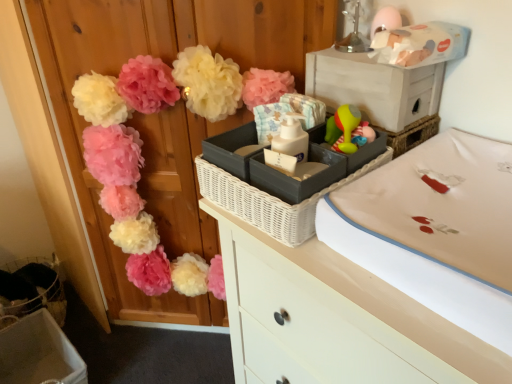
The width and height of the screenshot is (512, 384). What do you see at coordinates (442, 205) in the screenshot?
I see `beige fabric changing pad at center-right` at bounding box center [442, 205].

What do you see at coordinates (270, 201) in the screenshot? I see `black wicker basket at center` at bounding box center [270, 201].

The width and height of the screenshot is (512, 384). I want to click on matte plastic storage box at lower left, the 2th storage box from the front, so click(39, 352).

What is the approximate height of matte plastic storage box at lower left, arranged as the 1th storage box when viewed from the left?

10.54 inches.

Locate an element on the screen. This screenshot has height=384, width=512. matte gray storage box at upper right, acting as the 2th storage box starting from the back is located at coordinates (374, 87).

Considering their positions, is white glossy chest of drawers at upper center located in front of or behind matte gray storage box at upper right, the first storage box in the top-to-bottom sequence?

Clearly, white glossy chest of drawers at upper center is in front of matte gray storage box at upper right, the first storage box in the top-to-bottom sequence.

From a real-world perspective, is white glossy chest of drawers at upper center below matte gray storage box at upper right, the first storage box in the top-to-bottom sequence?

Yes.

Is matte gray storage box at upper right, which is counted as the first storage box, starting from the front, at the back of white glossy chest of drawers at upper center?

No, matte gray storage box at upper right, which is counted as the first storage box, starting from the front, is not at the back of white glossy chest of drawers at upper center.

Is black wicker basket at center bigger than white glossy chest of drawers at upper center?

No, black wicker basket at center is not bigger than white glossy chest of drawers at upper center.

From a real-world perspective, is black wicker basket at center physically below white glossy chest of drawers at upper center?

No.

Relative to white glossy chest of drawers at upper center, is black wicker basket at center in front or behind?

black wicker basket at center is behind white glossy chest of drawers at upper center.

Considering the relative sizes of black wicker basket at center and white glossy chest of drawers at upper center in the image provided, is black wicker basket at center wider than white glossy chest of drawers at upper center?

No, black wicker basket at center is not wider than white glossy chest of drawers at upper center.

Can you see matte plastic storage box at lower left, marked as the 1th storage box in a back-to-front arrangement, touching matte gray storage box at upper right, which is the second storage box in left-to-right order?

There is a gap between matte plastic storage box at lower left, marked as the 1th storage box in a back-to-front arrangement, and matte gray storage box at upper right, which is the second storage box in left-to-right order.

Considering the relative sizes of matte plastic storage box at lower left, the 2th storage box from the front, and matte gray storage box at upper right, which is the 2th storage box in bottom-to-top order, in the image provided, is matte plastic storage box at lower left, the 2th storage box from the front, smaller than matte gray storage box at upper right, which is the 2th storage box in bottom-to-top order,?

Incorrect, matte plastic storage box at lower left, the 2th storage box from the front, is not smaller in size than matte gray storage box at upper right, which is the 2th storage box in bottom-to-top order.

In terms of width, does matte plastic storage box at lower left, arranged as the second storage box when viewed from the top, look wider or thinner when compared to matte gray storage box at upper right, which is the second storage box in left-to-right order?

Considering their sizes, matte plastic storage box at lower left, arranged as the second storage box when viewed from the top, looks broader than matte gray storage box at upper right, which is the second storage box in left-to-right order.

Could you measure the distance between matte plastic storage box at lower left, the 2th storage box from the front, and matte gray storage box at upper right, positioned as the 1th storage box in right-to-left order?

matte plastic storage box at lower left, the 2th storage box from the front, is 1.42 meters away from matte gray storage box at upper right, positioned as the 1th storage box in right-to-left order.

Considering the positions of objects black wicker basket at center and matte pink pom-poms at upper left in the image provided, who is more to the right, black wicker basket at center or matte pink pom-poms at upper left?

black wicker basket at center.

Does point (219, 170) lie in front of point (233, 3)?

Yes, point (219, 170) is closer to viewer.

Consider the image. Is black wicker basket at center looking in the opposite direction of matte pink pom-poms at upper left?

No, black wicker basket at center is not facing the opposite direction of matte pink pom-poms at upper left.

Is the surface of black wicker basket at center in direct contact with matte pink pom-poms at upper left?

No, black wicker basket at center is not beside matte pink pom-poms at upper left.

Can you confirm if beige fabric changing pad at center-right is taller than matte plastic storage box at lower left, marked as the first storage box in a bottom-to-top arrangement?

Incorrect, the height of beige fabric changing pad at center-right is not larger of that of matte plastic storage box at lower left, marked as the first storage box in a bottom-to-top arrangement.

From the image's perspective, relative to matte plastic storage box at lower left, marked as the first storage box in a bottom-to-top arrangement, is beige fabric changing pad at center-right above or below?

beige fabric changing pad at center-right is situated higher than matte plastic storage box at lower left, marked as the first storage box in a bottom-to-top arrangement, in the image.

Considering the positions of objects matte pink pom-poms at upper left and beige fabric changing pad at center-right in the image provided, who is more to the left, matte pink pom-poms at upper left or beige fabric changing pad at center-right?

Positioned to the left is matte pink pom-poms at upper left.

From the image's perspective, is matte pink pom-poms at upper left above or below beige fabric changing pad at center-right?

Clearly, from the image's perspective, matte pink pom-poms at upper left is above beige fabric changing pad at center-right.

Measure the distance between matte pink pom-poms at upper left and beige fabric changing pad at center-right.

matte pink pom-poms at upper left and beige fabric changing pad at center-right are 26.14 inches apart.

Considering their positions, is matte pink pom-poms at upper left located in front of or behind beige fabric changing pad at center-right?

matte pink pom-poms at upper left is positioned farther from the viewer than beige fabric changing pad at center-right.

Do you think matte gray storage box at upper right, which is the second storage box in left-to-right order, is within beige fabric changing pad at center-right, or outside of it?

matte gray storage box at upper right, which is the second storage box in left-to-right order, is located beyond the bounds of beige fabric changing pad at center-right.

Which object is more forward, matte gray storage box at upper right, which is the 2th storage box in bottom-to-top order, or beige fabric changing pad at center-right?

beige fabric changing pad at center-right is more forward.

Measure the distance between matte gray storage box at upper right, which is counted as the first storage box, starting from the front, and beige fabric changing pad at center-right.

A distance of 8.75 inches exists between matte gray storage box at upper right, which is counted as the first storage box, starting from the front, and beige fabric changing pad at center-right.

This screenshot has width=512, height=384. Find the location of `chest of drawers located on the right of matte gray storage box at upper right, which is the second storage box in left-to-right order`. chest of drawers located on the right of matte gray storage box at upper right, which is the second storage box in left-to-right order is located at coordinates (335, 319).

This screenshot has width=512, height=384. I want to click on basket container above the white glossy chest of drawers at upper center (from the image's perspective), so click(270, 201).

When comparing their distances from matte plastic storage box at lower left, arranged as the second storage box when viewed from the top, does matte pink pom-poms at upper left or matte gray storage box at upper right, the first storage box in the top-to-bottom sequence, seem further?

matte gray storage box at upper right, the first storage box in the top-to-bottom sequence, is further to matte plastic storage box at lower left, arranged as the second storage box when viewed from the top.

Based on their spatial positions, is matte plastic storage box at lower left, arranged as the 1th storage box when viewed from the left, or white glossy chest of drawers at upper center further from matte pink pom-poms at upper left?

Based on the image, white glossy chest of drawers at upper center appears to be further to matte pink pom-poms at upper left.

When comparing their distances from matte plastic storage box at lower left, arranged as the second storage box when viewed from the top, does matte pink pom-poms at upper left or beige fabric changing pad at center-right seem further?

Based on the image, beige fabric changing pad at center-right appears to be further to matte plastic storage box at lower left, arranged as the second storage box when viewed from the top.

Based on their spatial positions, is beige fabric changing pad at center-right or black wicker basket at center closer to matte plastic storage box at lower left, marked as the 1th storage box in a back-to-front arrangement?

Among the two, black wicker basket at center is located nearer to matte plastic storage box at lower left, marked as the 1th storage box in a back-to-front arrangement.

Looking at the image, which one is located further to matte pink pom-poms at upper left, white glossy chest of drawers at upper center or beige fabric changing pad at center-right?

beige fabric changing pad at center-right is further to matte pink pom-poms at upper left.

When comparing their distances from black wicker basket at center, does beige fabric changing pad at center-right or matte plastic storage box at lower left, marked as the first storage box in a bottom-to-top arrangement, seem closer?

beige fabric changing pad at center-right.

Based on their spatial positions, is matte gray storage box at upper right, which is counted as the first storage box, starting from the front, or white glossy chest of drawers at upper center further from matte pink pom-poms at upper left?

Based on the image, white glossy chest of drawers at upper center appears to be further to matte pink pom-poms at upper left.

Considering their positions, is black wicker basket at center positioned further to matte pink pom-poms at upper left than beige fabric changing pad at center-right?

The object further to matte pink pom-poms at upper left is beige fabric changing pad at center-right.

You are a GUI agent. You are given a task and a screenshot of the screen. Output one action in this format:
    pyautogui.click(x=<x>, y=<y>)
    Task: Click on the armoire between matte plastic storage box at lower left, arranged as the 1th storage box when viewed from the left, and matte gray storage box at upper right, which is counted as the first storage box, starting from the front
    This screenshot has width=512, height=384.
    Given the screenshot: What is the action you would take?
    pyautogui.click(x=168, y=63)

Find the location of `basket container between matte plastic storage box at lower left, marked as the first storage box in a bottom-to-top arrangement, and matte gray storage box at upper right, which is the 2th storage box in bottom-to-top order, in the horizontal direction`. basket container between matte plastic storage box at lower left, marked as the first storage box in a bottom-to-top arrangement, and matte gray storage box at upper right, which is the 2th storage box in bottom-to-top order, in the horizontal direction is located at coordinates pyautogui.click(x=270, y=201).

I want to click on storage box situated between matte pink pom-poms at upper left and white glossy chest of drawers at upper center from left to right, so click(x=374, y=87).

I want to click on storage box between matte plastic storage box at lower left, arranged as the second storage box when viewed from the top, and white glossy chest of drawers at upper center, so click(x=374, y=87).